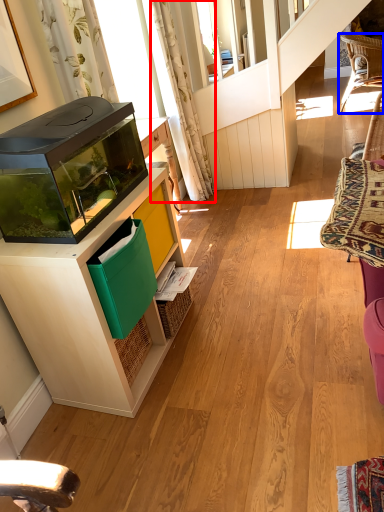
Question: Which of the following is the closest to the observer, curtain (highlighted by a red box) or chair (highlighted by a blue box)?

Choices:
 (A) curtain
 (B) chair

Answer: (A)